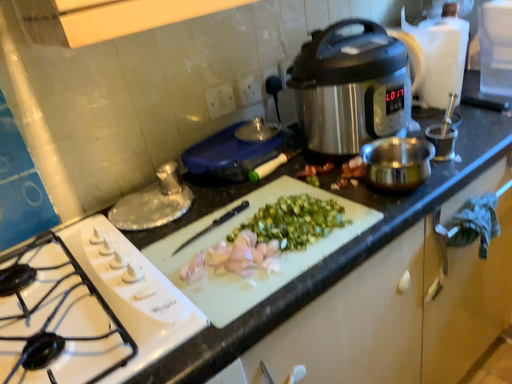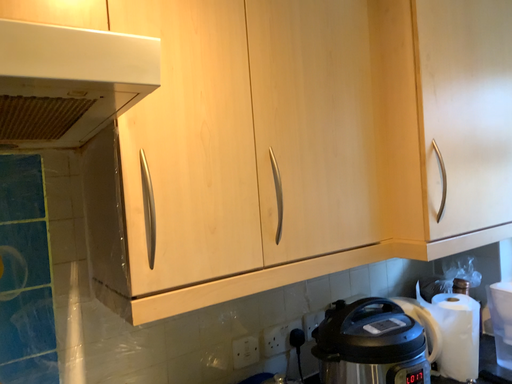
Question: How did the camera likely rotate when shooting the video?

Choices:
 (A) rotated downward
 (B) rotated upward

Answer: (B)